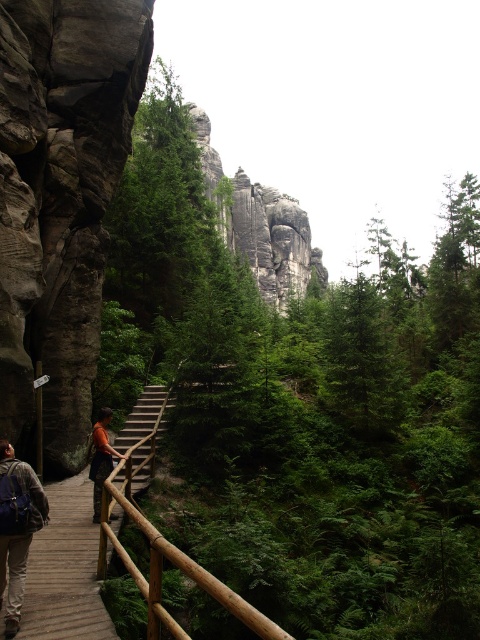
Question: Is wooden walkway at center closer to camera compared to brown wooden rail at lower center?

Choices:
 (A) yes
 (B) no

Answer: (B)

Question: Where is brown wooden rail at lower center located in relation to orange fabric shirt at center in the image?

Choices:
 (A) left
 (B) right

Answer: (B)

Question: Which point is closer to the camera?

Choices:
 (A) (245, 604)
 (B) (116, 444)
 (C) (80, 550)
 (D) (29, 528)

Answer: (A)

Question: Can you confirm if brown wooden rail at lower center is positioned above wooden stairs at center?

Choices:
 (A) no
 (B) yes

Answer: (A)

Question: Which point is closer to the camera taking this photo?

Choices:
 (A) (82, 545)
 (B) (183, 637)
 (C) (137, 442)
 (D) (95, 486)

Answer: (B)

Question: Which object is positioned closest to the blue fabric backpack at lower left?

Choices:
 (A) brown wooden rail at lower center
 (B) wooden walkway at center

Answer: (B)